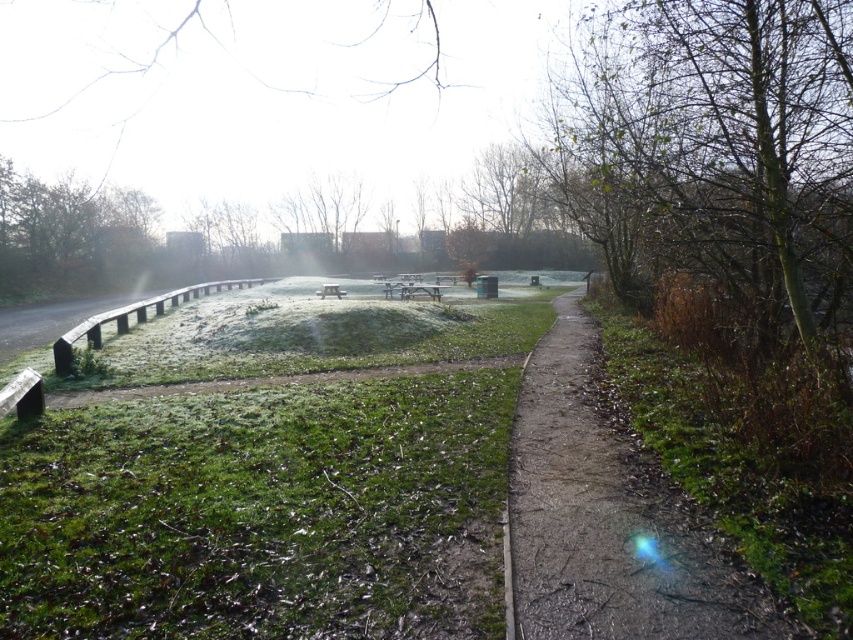
You are standing at the point with coordinates point (341, 296) and want to walk towards the point with coordinates point (683, 49). According to the image, which direction should you face to move towards the correct point?

Since point (683, 49) is in front of point (341, 296), you should face towards the direction where point (683, 49) is located to move towards it.